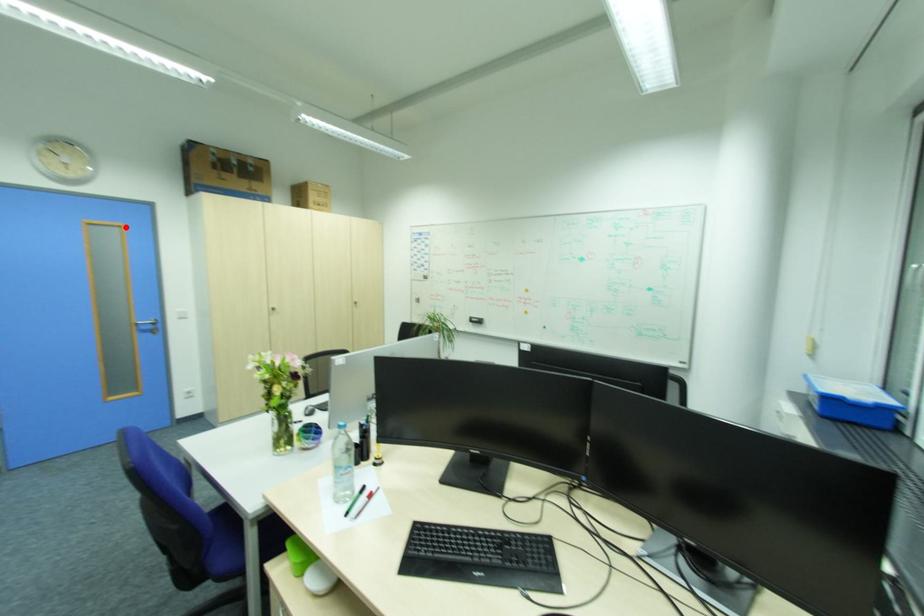
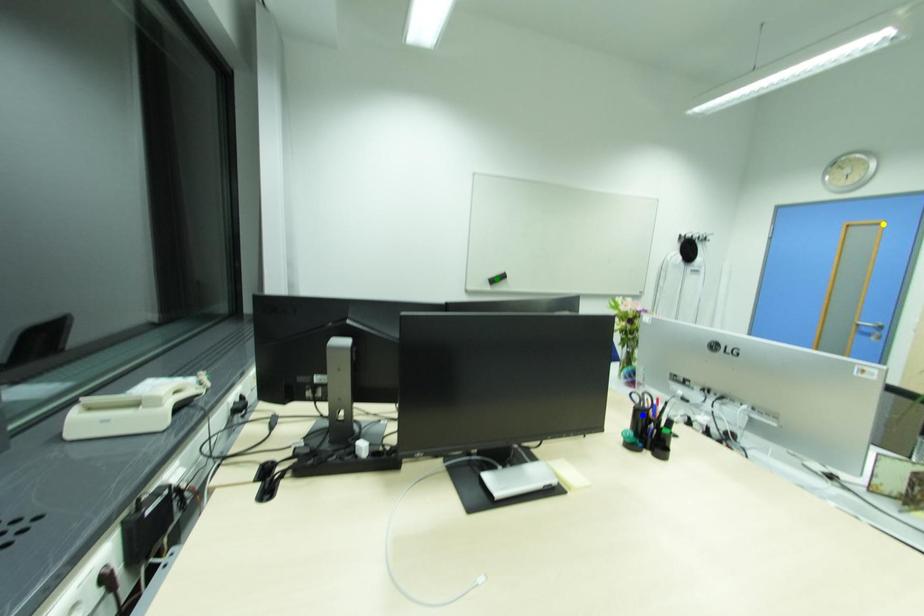
Question: I am providing you with two images of the same scene from different viewpoints. A red point is marked on the first image. You are given multiple points on the second image. Can you choose the point in image 2 that corresponds to the point in image 1?

Choices:
 (A) blue point
 (B) green point
 (C) yellow point

Answer: (C)